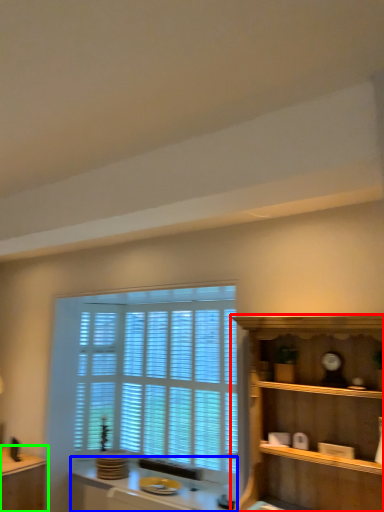
Question: Which is nearer to the shelf (highlighted by a red box)? vanity (highlighted by a blue box) or table (highlighted by a green box).

Choices:
 (A) vanity
 (B) table

Answer: (A)